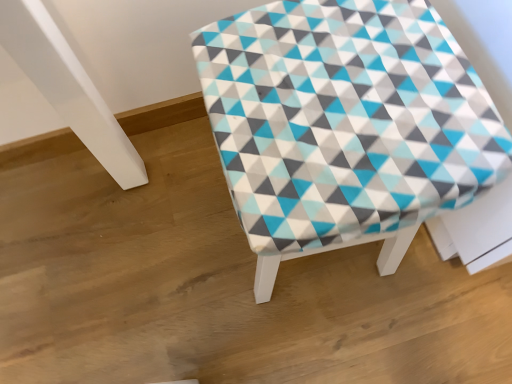
Locate an element on the screen. The image size is (512, 384). vacant space situated on the left part of matte fabric stool at center is located at coordinates (201, 226).